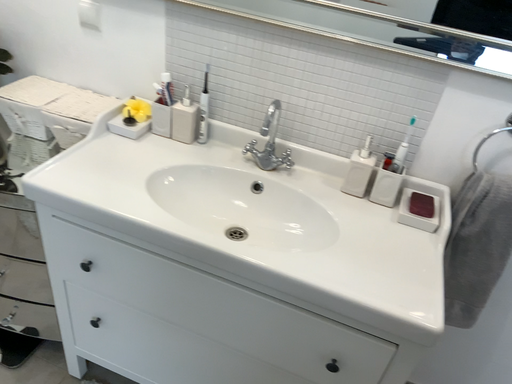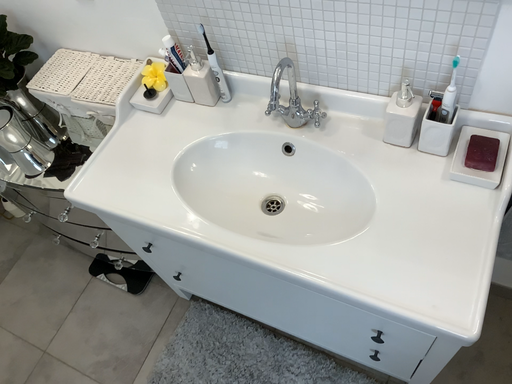
Question: How did the camera likely rotate when shooting the video?

Choices:
 (A) rotated right
 (B) rotated left

Answer: (B)